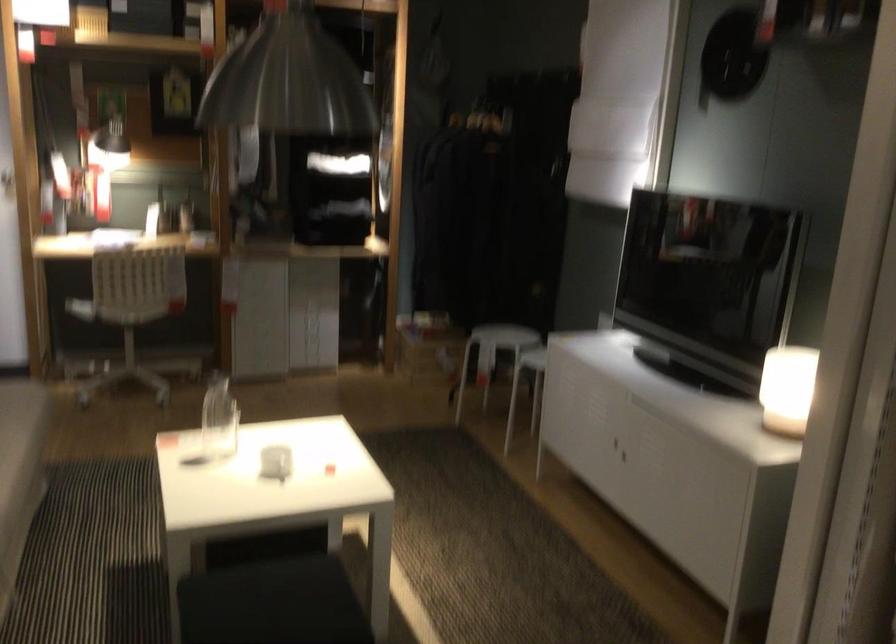
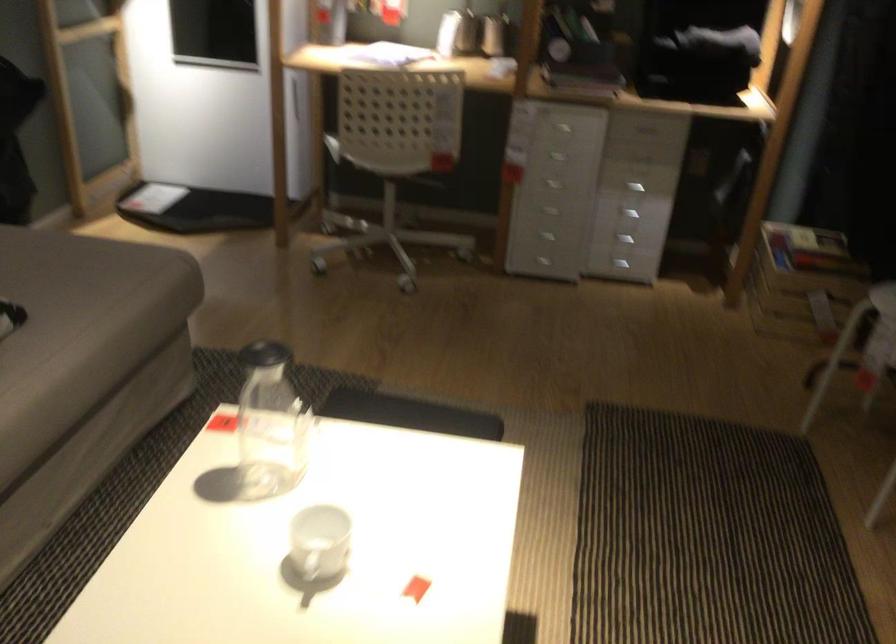
Locate, in the second image, the point that corresponds to point (132, 308) in the first image.

(388, 158)